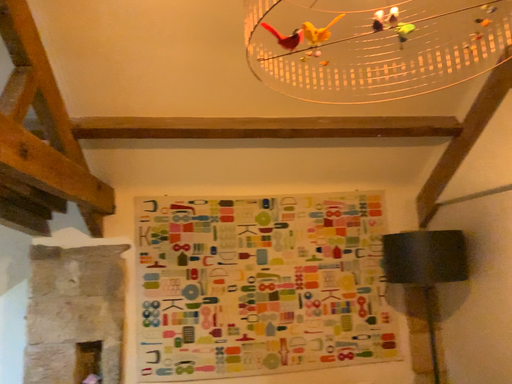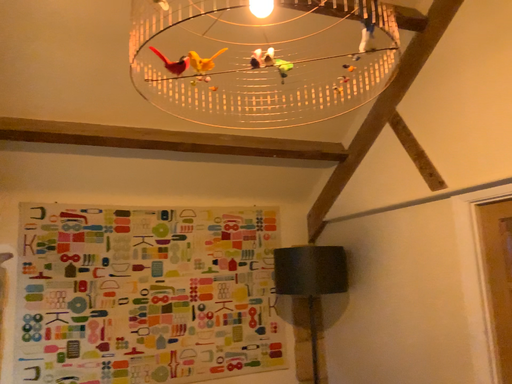
Question: Which way did the camera rotate in the video?

Choices:
 (A) rotated left
 (B) rotated right

Answer: (B)